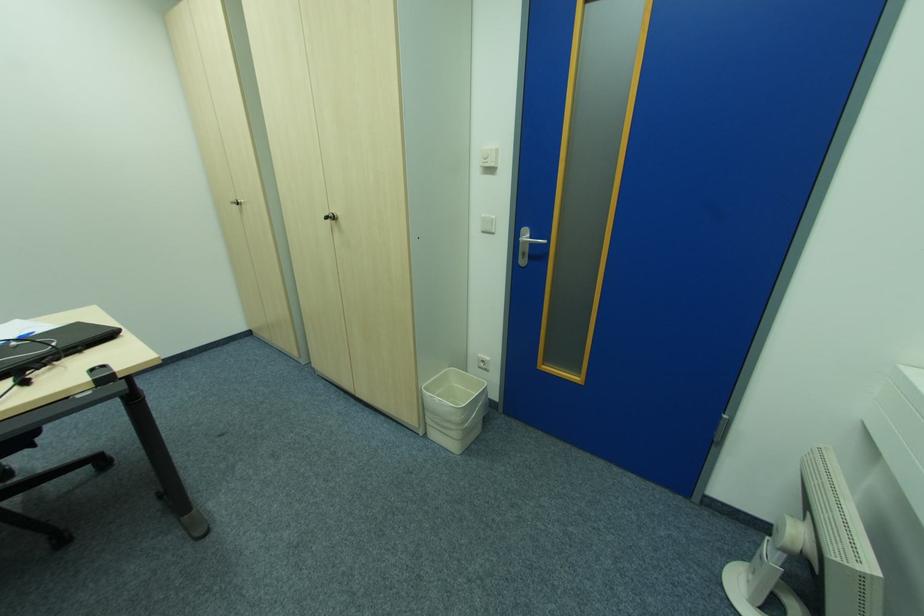
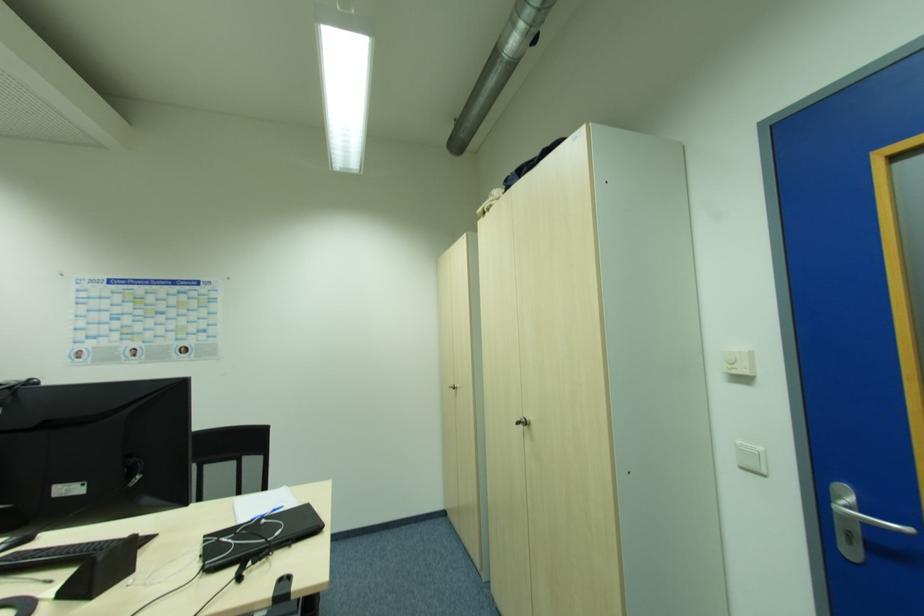
In the second image, find the point that corresponds to the point at 485,233 in the first image.

(746, 469)